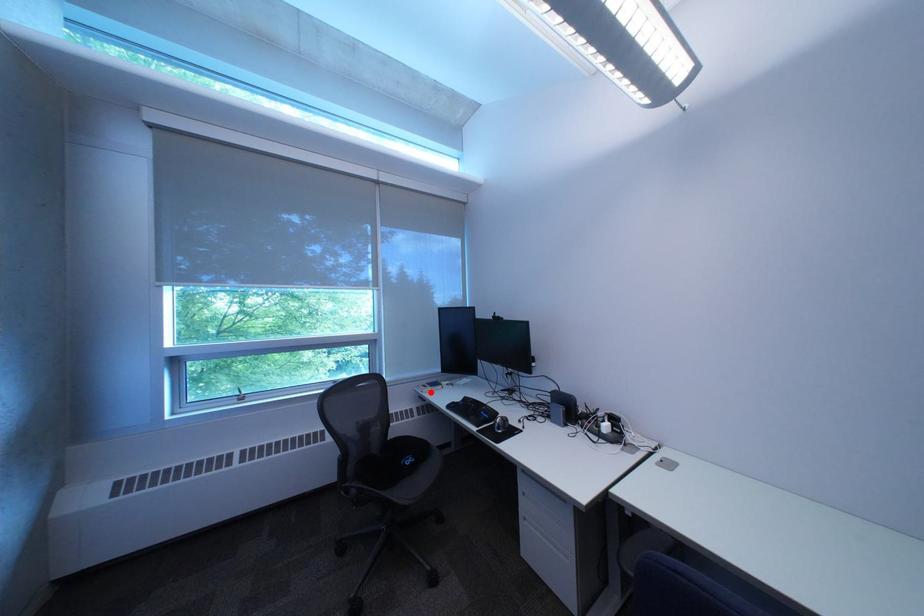
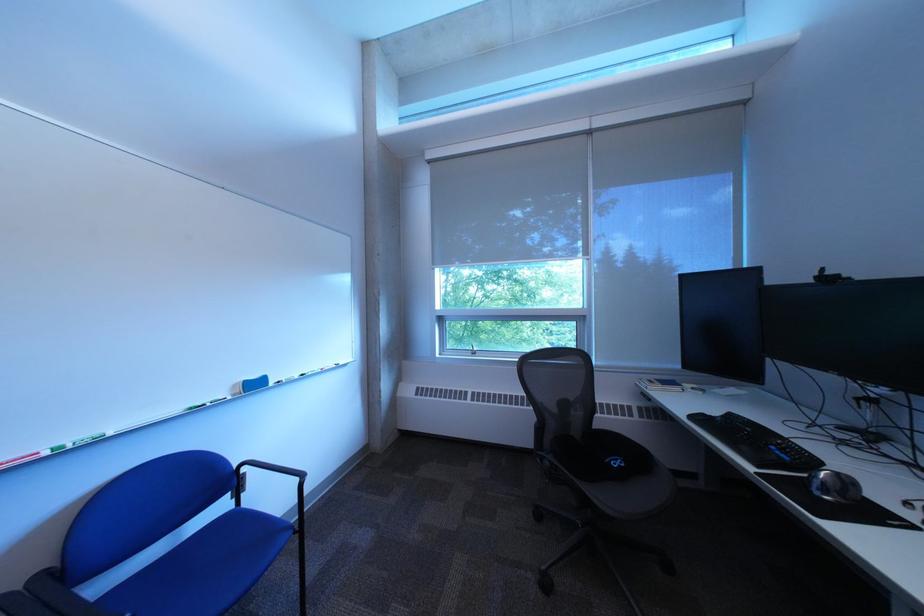
The point at the highlighted location is marked in the first image. Where is the corresponding point in the second image?

(651, 386)